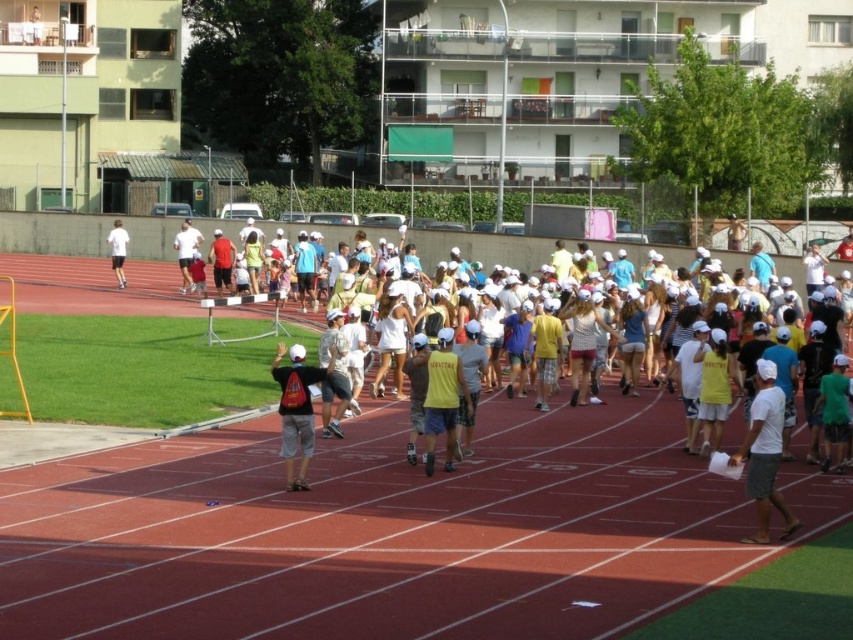
You are a photographer positioned at the edge of the running track. You notice two items worn by a participant at the center of the image. What is the spatial relationship between the matte gray shorts at center and the matte red shirt at center?

The matte gray shorts at center is located below the matte red shirt at center.

You are standing at the center of the running track and see the point at coordinates (296, 410). What object is located at that point?

The point at coordinates (296, 410) is located on matte gray shorts at center.